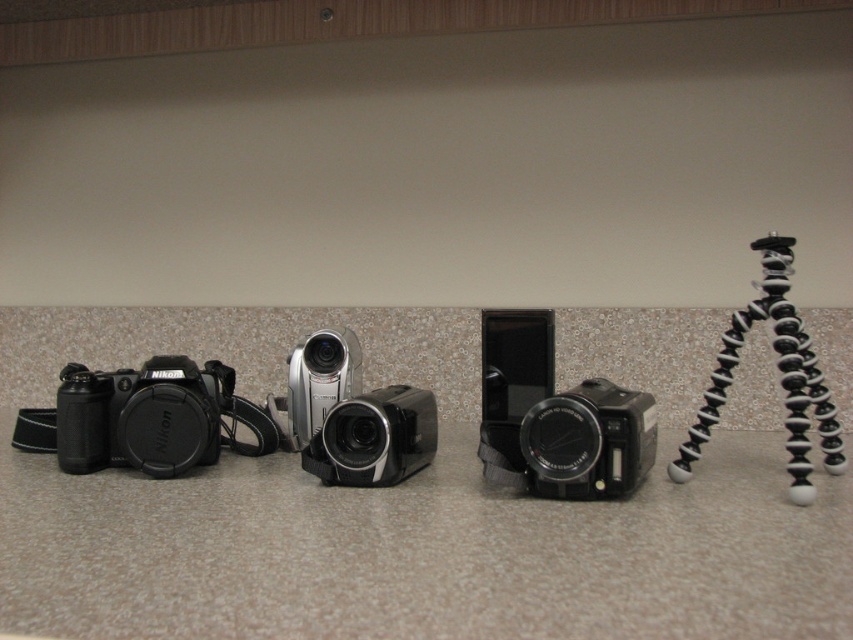
Does black plastic camcorder at center appear under silver metallic camcorder at center?

Yes.

Which is behind, point (390, 420) or point (323, 339)?

The point (323, 339) is more distant.

What do you see at coordinates (374, 438) in the screenshot? Image resolution: width=853 pixels, height=640 pixels. I see `black plastic camcorder at center` at bounding box center [374, 438].

The height and width of the screenshot is (640, 853). In order to click on black plastic camcorder at center in this screenshot , I will do `click(374, 438)`.

Between black rubberized tripod at right and black plastic camera at center, which one has less height?

black plastic camera at center

Which is below, black rubberized tripod at right or black plastic camera at center?

black plastic camera at center

Where is `black rubberized tripod at right`? This screenshot has height=640, width=853. black rubberized tripod at right is located at coordinates (780, 378).

At what (x,y) coordinates should I click in order to perform the action: click on black rubberized tripod at right. Please return your answer as a coordinate pair (x, y). The image size is (853, 640). Looking at the image, I should click on (780, 378).

From the picture: Between black rubberized tripod at right and silver metallic camcorder at center, which one has less height?

silver metallic camcorder at center

Find the location of a particular element. This screenshot has width=853, height=640. black rubberized tripod at right is located at coordinates (780, 378).

At what (x,y) coordinates should I click in order to perform the action: click on black rubberized tripod at right. Please return your answer as a coordinate pair (x, y). Looking at the image, I should click on (780, 378).

Identify the location of black rubberized tripod at right. This screenshot has height=640, width=853. (780, 378).